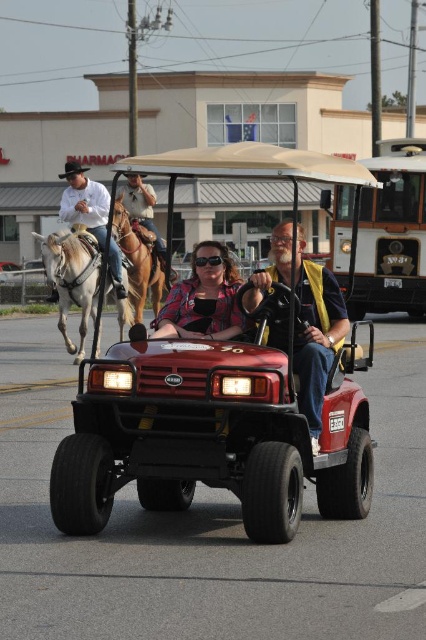
You are standing on the sidewalk and see the golf cart with two people and the two horse riders. You want to take a photo that includes both the golf cart and the horse riders. Which of the two points, point (x=175, y=310) or point (x=72, y=188), should you focus on to ensure both subjects are in the frame?

You should focus on point (x=175, y=310) because it is closer to the viewer, allowing both the golf cart and the horse riders to be captured in the photo.

You are a pedestrian standing on the sidewalk next to the shiny red golf cart at center and the brown leather horse at center. Which one is higher from the ground?

The shiny red golf cart at center is above brown leather horse at center, so the shiny red golf cart at center is higher from the ground.